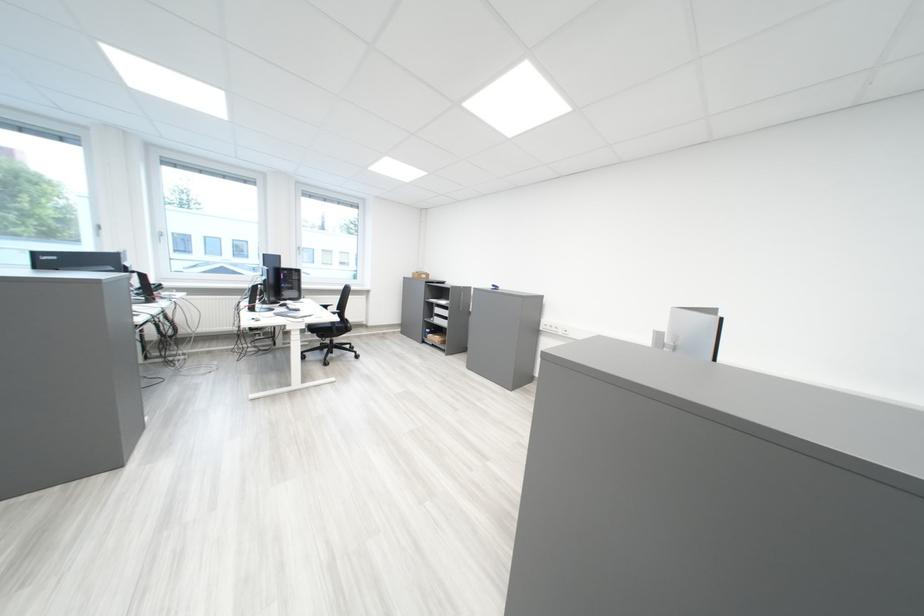
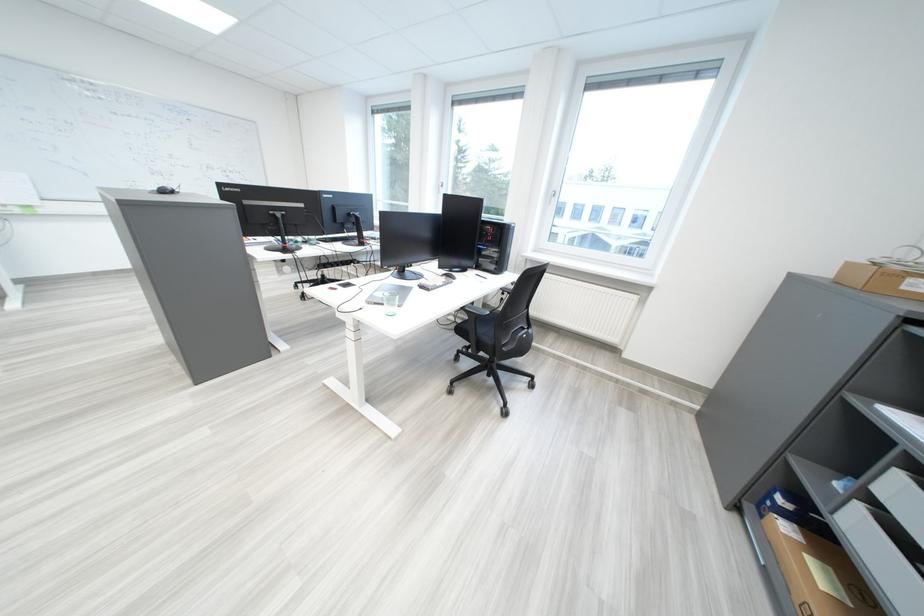
In the second image, find the point that corresponds to point (423, 277) in the first image.

(839, 274)